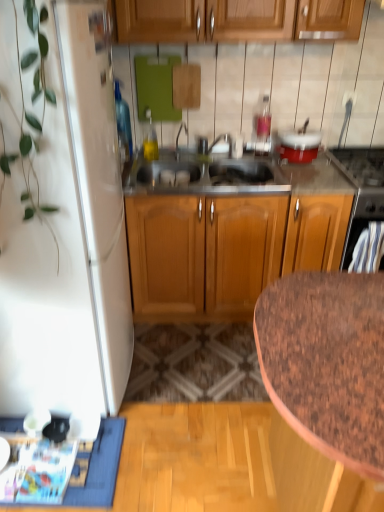
Question: Can you see black glass stove at upper right, which ranks as the 1th appliance in right-to-left order, touching red glossy pot at upper right, which is the 1th appliance in left-to-right order?

Choices:
 (A) yes
 (B) no

Answer: (B)

Question: Is there a large distance between black glass stove at upper right, which ranks as the 1th appliance in right-to-left order, and red glossy pot at upper right, which is the 1th appliance in left-to-right order?

Choices:
 (A) yes
 (B) no

Answer: (B)

Question: Can you confirm if black glass stove at upper right, positioned as the 2th appliance in left-to-right order, is thinner than red glossy pot at upper right, which is the 1th appliance in left-to-right order?

Choices:
 (A) yes
 (B) no

Answer: (B)

Question: Is black glass stove at upper right, positioned as the 2th appliance in left-to-right order, further to the viewer compared to red glossy pot at upper right, which ranks as the 2th appliance in right-to-left order?

Choices:
 (A) no
 (B) yes

Answer: (A)

Question: Can you confirm if black glass stove at upper right, positioned as the 2th appliance in left-to-right order, is shorter than red glossy pot at upper right, which is the 1th appliance in left-to-right order?

Choices:
 (A) no
 (B) yes

Answer: (A)

Question: Is black glass stove at upper right, which ranks as the 1th appliance in right-to-left order, to the left of red glossy pot at upper right, which is the 1th appliance in left-to-right order, from the viewer's perspective?

Choices:
 (A) no
 (B) yes

Answer: (A)

Question: From the image's perspective, is white matte refrigerator at left under blue fabric doormat at lower left?

Choices:
 (A) yes
 (B) no

Answer: (B)

Question: Considering the relative sizes of white matte refrigerator at left and blue fabric doormat at lower left in the image provided, is white matte refrigerator at left wider than blue fabric doormat at lower left?

Choices:
 (A) no
 (B) yes

Answer: (B)

Question: Considering the relative sizes of white matte refrigerator at left and blue fabric doormat at lower left in the image provided, is white matte refrigerator at left shorter than blue fabric doormat at lower left?

Choices:
 (A) no
 (B) yes

Answer: (A)

Question: Is blue fabric doormat at lower left located within white matte refrigerator at left?

Choices:
 (A) no
 (B) yes

Answer: (A)

Question: From a real-world perspective, is white matte refrigerator at left located beneath blue fabric doormat at lower left?

Choices:
 (A) no
 (B) yes

Answer: (A)

Question: Is white matte refrigerator at left not within blue fabric doormat at lower left?

Choices:
 (A) no
 (B) yes

Answer: (B)

Question: Is brown speckled granite at lower right smaller than black glass stove at upper right, which ranks as the 1th appliance in right-to-left order?

Choices:
 (A) no
 (B) yes

Answer: (A)